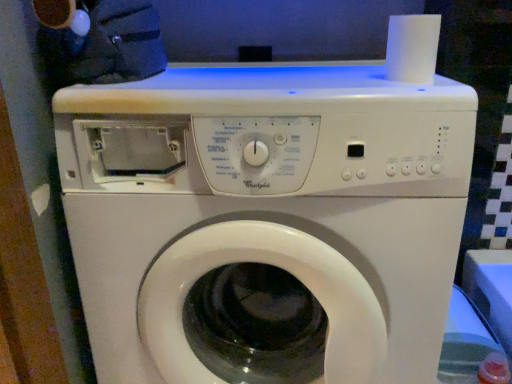
Question: Could you tell me if white matte paper towel at upper right is turned towards white plastic washing machine at center?

Choices:
 (A) yes
 (B) no

Answer: (B)

Question: Is white matte paper towel at upper right taller than white plastic washing machine at center?

Choices:
 (A) yes
 (B) no

Answer: (B)

Question: Can you confirm if white matte paper towel at upper right is bigger than white plastic washing machine at center?

Choices:
 (A) yes
 (B) no

Answer: (B)

Question: Does white matte paper towel at upper right have a smaller size compared to white plastic washing machine at center?

Choices:
 (A) yes
 (B) no

Answer: (A)

Question: From the image's perspective, is white matte paper towel at upper right located beneath white plastic washing machine at center?

Choices:
 (A) no
 (B) yes

Answer: (A)

Question: Is white matte paper towel at upper right in front of white plastic washing machine at center?

Choices:
 (A) no
 (B) yes

Answer: (A)

Question: Could you tell me if white plastic washing machine at center is facing white matte paper towel at upper right?

Choices:
 (A) yes
 (B) no

Answer: (B)

Question: Can you confirm if white plastic washing machine at center is bigger than white matte paper towel at upper right?

Choices:
 (A) yes
 (B) no

Answer: (A)

Question: Are white plastic washing machine at center and white matte paper towel at upper right far apart?

Choices:
 (A) yes
 (B) no

Answer: (B)

Question: Could white matte paper towel at upper right be considered to be inside white plastic washing machine at center?

Choices:
 (A) no
 (B) yes

Answer: (A)

Question: Is white plastic washing machine at center oriented away from white matte paper towel at upper right?

Choices:
 (A) yes
 (B) no

Answer: (B)

Question: Considering the relative sizes of white plastic washing machine at center and white matte paper towel at upper right in the image provided, is white plastic washing machine at center taller than white matte paper towel at upper right?

Choices:
 (A) yes
 (B) no

Answer: (A)

Question: Looking at the image, does white plastic washing machine at center seem bigger or smaller compared to white matte paper towel at upper right?

Choices:
 (A) big
 (B) small

Answer: (A)